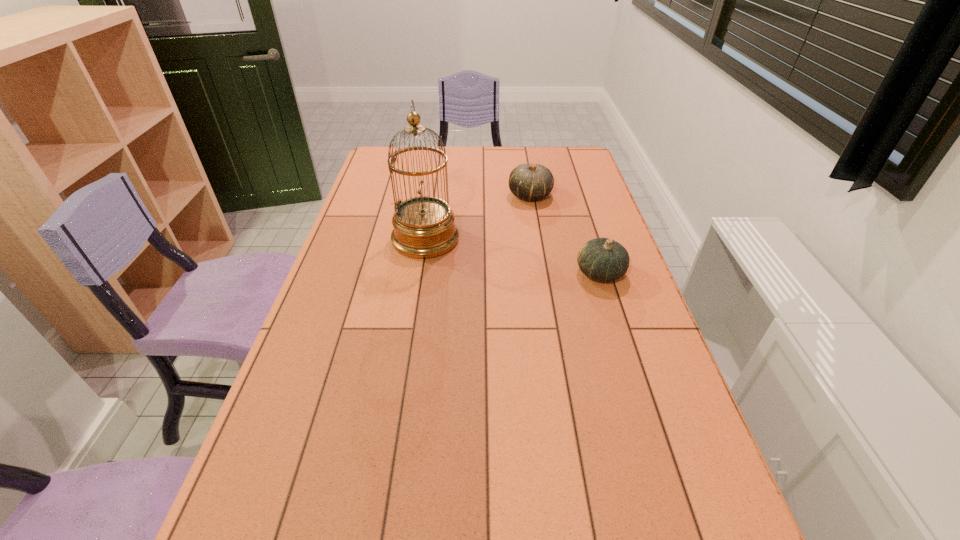
This screenshot has height=540, width=960. In order to click on birdcage in this screenshot , I will do `click(424, 227)`.

Locate an element on the screen. This screenshot has height=540, width=960. the tallest object is located at coordinates (424, 227).

Find the location of a particular element. the left gourd is located at coordinates (530, 182).

I want to click on the second object from right to left, so click(530, 182).

I want to click on the rightmost object, so click(x=602, y=259).

You are a GUI agent. You are given a task and a screenshot of the screen. Output one action in this format:
    pyautogui.click(x=<x>, y=<y>)
    Task: Click on the nearer gourd
    This screenshot has height=540, width=960.
    Given the screenshot: What is the action you would take?
    pyautogui.click(x=602, y=259)

Locate an element on the screen. free space located with an open door on the birdcage is located at coordinates (548, 239).

Find the location of a particular element. The image size is (960, 540). free region located on the right of the left gourd is located at coordinates (584, 195).

The width and height of the screenshot is (960, 540). What are the coordinates of `vacant space located on the front of the right gourd` in the screenshot? It's located at (610, 303).

Where is `object located in the left edge section of the desktop`? The height and width of the screenshot is (540, 960). object located in the left edge section of the desktop is located at coordinates [x=424, y=227].